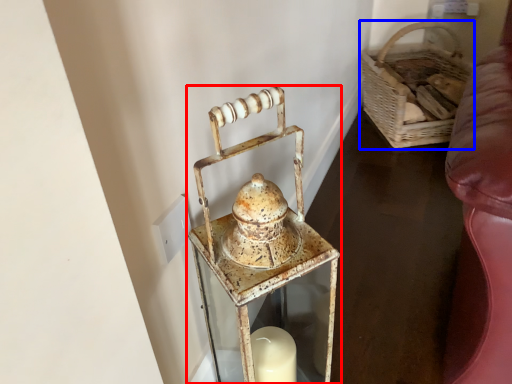
Question: Which object is further to the camera taking this photo, lantern (highlighted by a red box) or basket (highlighted by a blue box)?

Choices:
 (A) lantern
 (B) basket

Answer: (B)